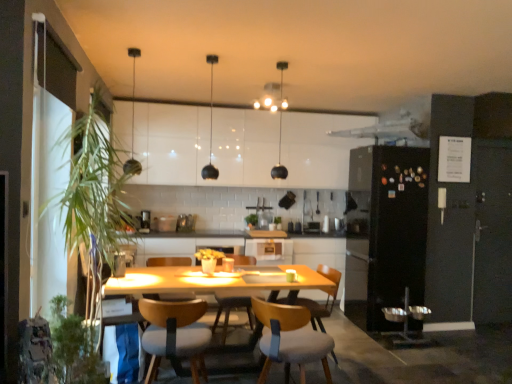
Where is `vacant region below metallic silver toaster at center, acting as the 1th appliance starting from the right (from a real-world perspective)`? The image size is (512, 384). vacant region below metallic silver toaster at center, acting as the 1th appliance starting from the right (from a real-world perspective) is located at coordinates (183, 229).